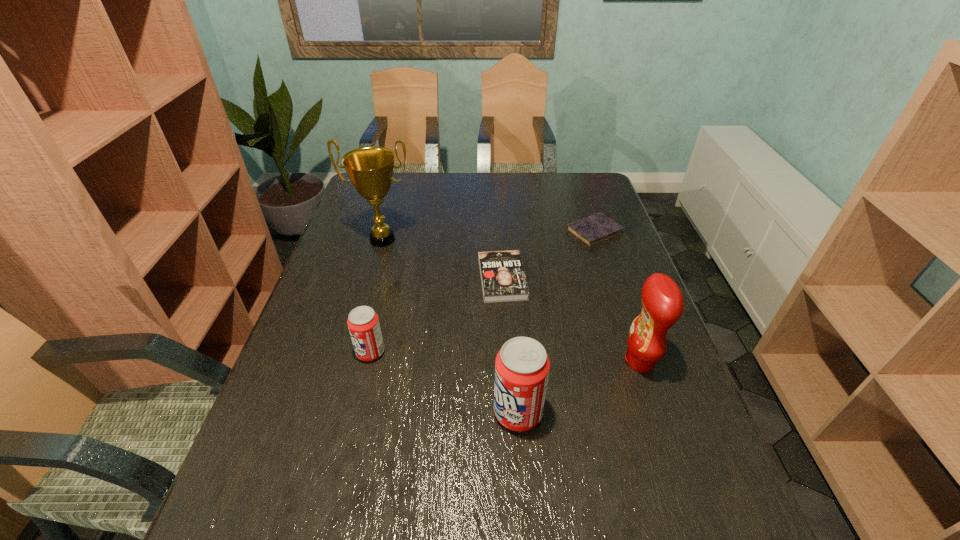
This screenshot has width=960, height=540. What are the coordinates of `vacant point that satisfies the following two spatial constraints: 1. on the front view with handles of the tallest object; 2. on the left side of the fifth tallest object` in the screenshot? It's located at (372, 279).